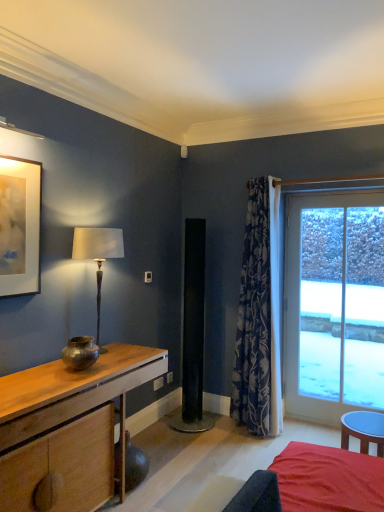
Where is `free spot above velvet red bed at lower right (from a real-world perspective)`? The width and height of the screenshot is (384, 512). free spot above velvet red bed at lower right (from a real-world perspective) is located at coordinates (335, 465).